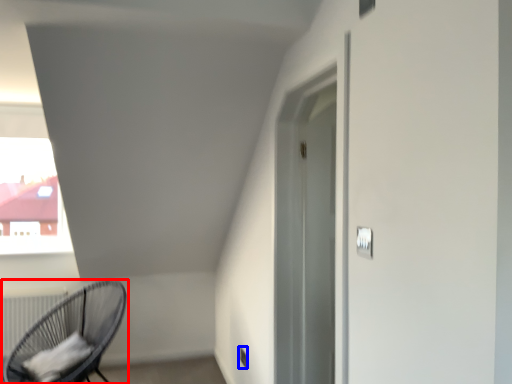
Question: Which of the following is the closest to the observer, chair (highlighted by a red box) or electric outlet (highlighted by a blue box)?

Choices:
 (A) chair
 (B) electric outlet

Answer: (A)